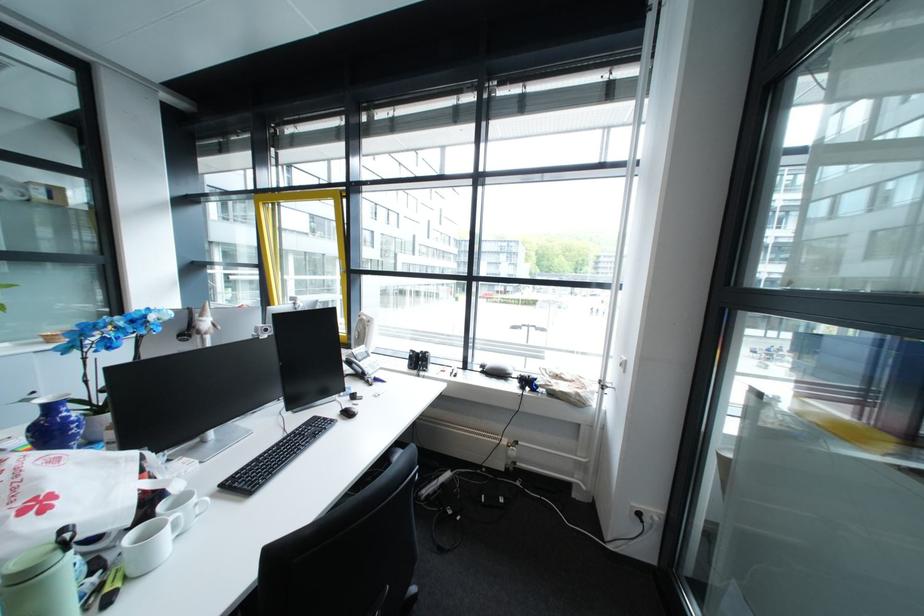
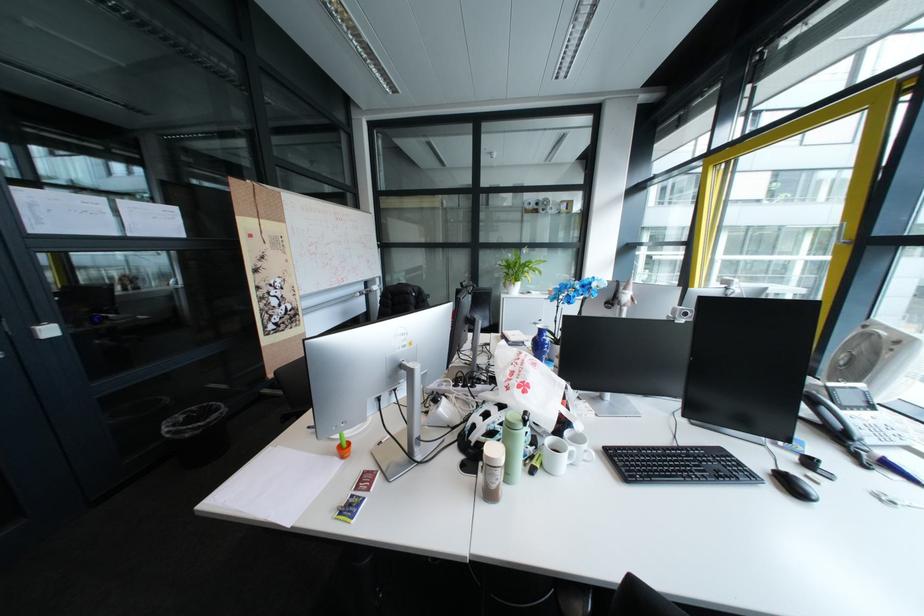
In the second image, find the point that corresponds to (180,529) in the first image.

(580, 455)